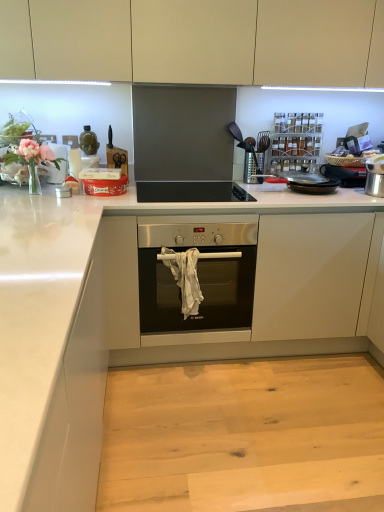
Question: Can you confirm if white glossy countertop at center is thinner than metallic spice rack at upper right?

Choices:
 (A) yes
 (B) no

Answer: (B)

Question: Is white glossy countertop at center shorter than metallic spice rack at upper right?

Choices:
 (A) yes
 (B) no

Answer: (B)

Question: From a real-world perspective, is white glossy countertop at center below metallic spice rack at upper right?

Choices:
 (A) yes
 (B) no

Answer: (A)

Question: Is white glossy countertop at center next to metallic spice rack at upper right?

Choices:
 (A) yes
 (B) no

Answer: (B)

Question: From a real-world perspective, is white glossy countertop at center over metallic spice rack at upper right?

Choices:
 (A) no
 (B) yes

Answer: (A)

Question: Does white glossy countertop at center appear on the left side of metallic spice rack at upper right?

Choices:
 (A) yes
 (B) no

Answer: (A)

Question: Can you confirm if metallic spice rack at upper right is positioned to the right of black matte gas stove at upper center?

Choices:
 (A) no
 (B) yes

Answer: (B)

Question: Is metallic spice rack at upper right outside of black matte gas stove at upper center?

Choices:
 (A) yes
 (B) no

Answer: (A)

Question: Can you confirm if metallic spice rack at upper right is smaller than black matte gas stove at upper center?

Choices:
 (A) no
 (B) yes

Answer: (B)

Question: Considering the relative positions of metallic spice rack at upper right and black matte gas stove at upper center in the image provided, is metallic spice rack at upper right in front of black matte gas stove at upper center?

Choices:
 (A) no
 (B) yes

Answer: (A)

Question: Is metallic spice rack at upper right wider than black matte gas stove at upper center?

Choices:
 (A) no
 (B) yes

Answer: (A)

Question: Considering the relative positions of metallic spice rack at upper right and black matte gas stove at upper center in the image provided, is metallic spice rack at upper right behind black matte gas stove at upper center?

Choices:
 (A) no
 (B) yes

Answer: (B)

Question: Would you say black matte gas stove at upper center is outside white glossy countertop at center?

Choices:
 (A) no
 (B) yes

Answer: (A)